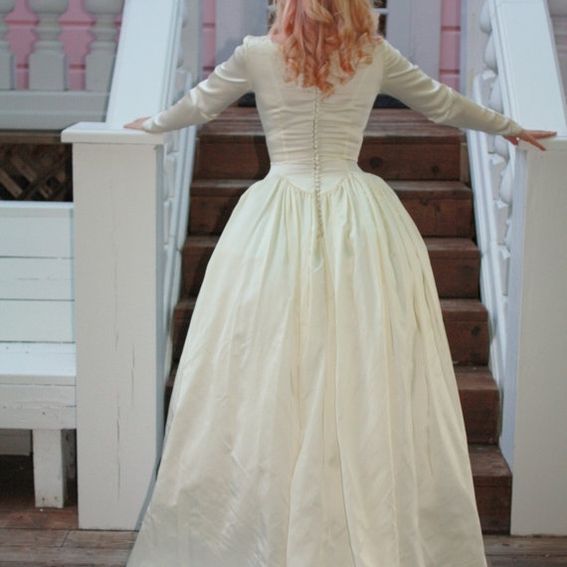
You are a GUI agent. You are given a task and a screenshot of the screen. Output one action in this format:
    pyautogui.click(x=<x>, y=<y>)
    Task: Click on the white wooden bench
    Image resolution: width=567 pixels, height=567 pixels.
    Given the screenshot: What is the action you would take?
    pyautogui.click(x=35, y=363)